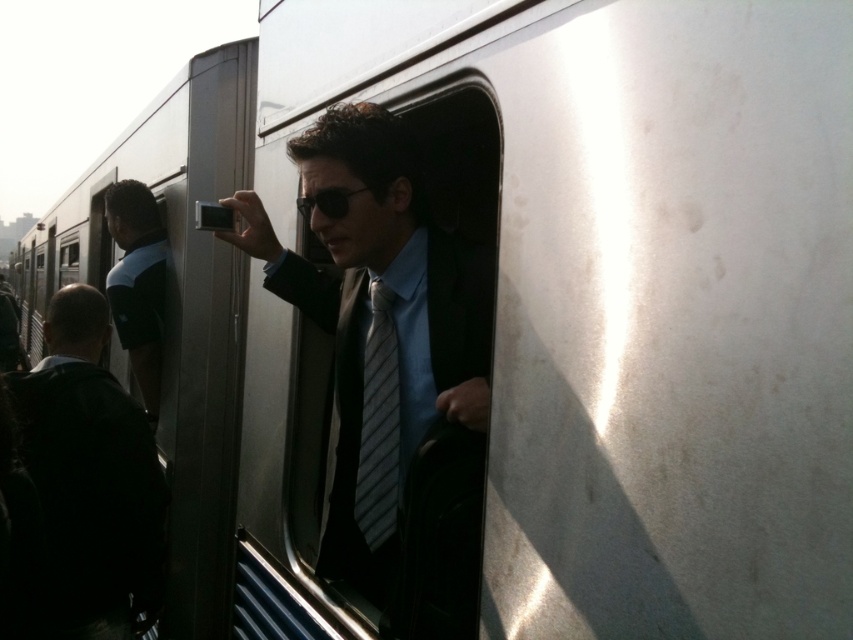
Question: Does matte black suit at center have a lesser width compared to dark blue shirt at left?

Choices:
 (A) no
 (B) yes

Answer: (A)

Question: Does dark blue shirt at left appear under striped fabric tie at center?

Choices:
 (A) no
 (B) yes

Answer: (A)

Question: Can you confirm if shiny black suit at center is positioned to the left of dark blue shirt at left?

Choices:
 (A) yes
 (B) no

Answer: (B)

Question: Among these points, which one is nearest to the camera?

Choices:
 (A) (138, 362)
 (B) (469, 362)

Answer: (B)

Question: Which is farther from the dark blue shirt at left?

Choices:
 (A) matte black suit at center
 (B) striped fabric tie at center
 (C) shiny black suit at center

Answer: (B)

Question: Which of the following is the closest to the observer?

Choices:
 (A) dark blue shirt at left
 (B) shiny black suit at center

Answer: (B)